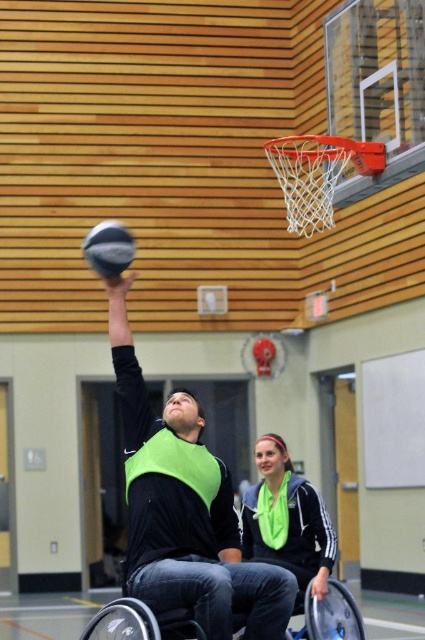
Question: Which object is closer to the camera taking this photo?

Choices:
 (A) silver metallic wheelchair at center
 (B) green fabric scarf at center

Answer: (B)

Question: Does green fabric scarf at center appear over rubber textured basketball at center?

Choices:
 (A) yes
 (B) no

Answer: (B)

Question: Does rubber textured basketball at center have a larger size compared to metallic silver basketball hoop at center?

Choices:
 (A) no
 (B) yes

Answer: (A)

Question: Which object is positioned closest to the green fabric scarf at center?

Choices:
 (A) rubber textured basketball at center
 (B) metallic silver basketball hoop at center

Answer: (A)

Question: Does silver metallic wheelchair at center have a larger size compared to rubber textured basketball at center?

Choices:
 (A) yes
 (B) no

Answer: (A)

Question: Which of the following is the farthest from the observer?

Choices:
 (A) (268, 486)
 (B) (96, 618)
 (C) (104, 244)

Answer: (A)